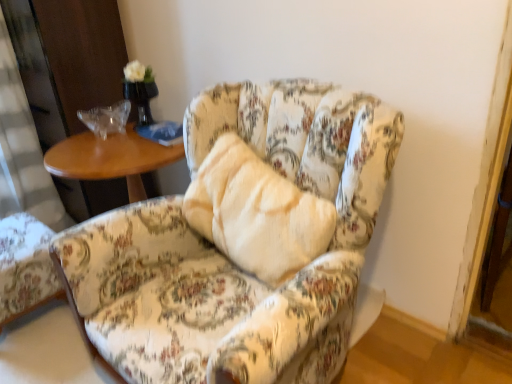
Question: Can you confirm if floral fabric armchair at lower left, which ranks as the 1th chair in left-to-right order, is thinner than floral fabric chair at center, placed as the first chair when sorted from right to left?

Choices:
 (A) no
 (B) yes

Answer: (B)

Question: Is floral fabric armchair at lower left, which ranks as the 1th chair in left-to-right order, outside of floral fabric chair at center, marked as the 2th chair in a left-to-right arrangement?

Choices:
 (A) yes
 (B) no

Answer: (A)

Question: Considering the relative positions of floral fabric armchair at lower left, which ranks as the 1th chair in left-to-right order, and floral fabric chair at center, marked as the 2th chair in a left-to-right arrangement, in the image provided, is floral fabric armchair at lower left, which ranks as the 1th chair in left-to-right order, to the left of floral fabric chair at center, marked as the 2th chair in a left-to-right arrangement, from the viewer's perspective?

Choices:
 (A) yes
 (B) no

Answer: (A)

Question: Can you confirm if floral fabric armchair at lower left, which ranks as the 1th chair in left-to-right order, is bigger than floral fabric chair at center, marked as the 2th chair in a left-to-right arrangement?

Choices:
 (A) no
 (B) yes

Answer: (A)

Question: Is floral fabric armchair at lower left, the 2th chair in the right-to-left sequence, facing away from floral fabric chair at center, marked as the 2th chair in a left-to-right arrangement?

Choices:
 (A) no
 (B) yes

Answer: (A)

Question: From the image's perspective, would you say floral fabric armchair at lower left, the 2th chair in the right-to-left sequence, is positioned over floral fabric chair at center, marked as the 2th chair in a left-to-right arrangement?

Choices:
 (A) no
 (B) yes

Answer: (A)

Question: Is floral fabric chair at center, marked as the 2th chair in a left-to-right arrangement, in front of floral fabric armchair at lower left, the 2th chair in the right-to-left sequence?

Choices:
 (A) no
 (B) yes

Answer: (B)

Question: From the image's perspective, is floral fabric chair at center, placed as the first chair when sorted from right to left, located above floral fabric armchair at lower left, which ranks as the 1th chair in left-to-right order?

Choices:
 (A) yes
 (B) no

Answer: (A)

Question: Considering the relative positions of floral fabric chair at center, marked as the 2th chair in a left-to-right arrangement, and floral fabric armchair at lower left, which ranks as the 1th chair in left-to-right order, in the image provided, is floral fabric chair at center, marked as the 2th chair in a left-to-right arrangement, to the left of floral fabric armchair at lower left, which ranks as the 1th chair in left-to-right order, from the viewer's perspective?

Choices:
 (A) no
 (B) yes

Answer: (A)

Question: Is there a large distance between floral fabric chair at center, placed as the first chair when sorted from right to left, and floral fabric armchair at lower left, which ranks as the 1th chair in left-to-right order?

Choices:
 (A) yes
 (B) no

Answer: (B)

Question: From a real-world perspective, does floral fabric chair at center, marked as the 2th chair in a left-to-right arrangement, sit lower than floral fabric armchair at lower left, the 2th chair in the right-to-left sequence?

Choices:
 (A) yes
 (B) no

Answer: (B)

Question: Would you say floral fabric chair at center, placed as the first chair when sorted from right to left, is outside floral fabric armchair at lower left, which ranks as the 1th chair in left-to-right order?

Choices:
 (A) no
 (B) yes

Answer: (B)

Question: From the image's perspective, relative to floral fabric armchair at lower left, which ranks as the 1th chair in left-to-right order, is floral fabric chair at center, placed as the first chair when sorted from right to left, above or below?

Choices:
 (A) above
 (B) below

Answer: (A)